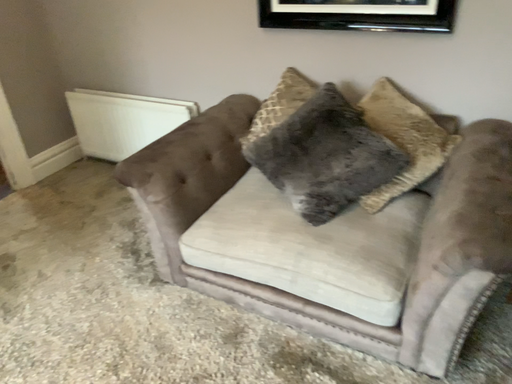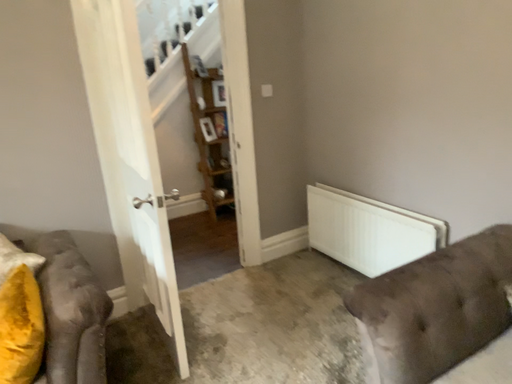
Question: How did the camera likely rotate when shooting the video?

Choices:
 (A) rotated upward
 (B) rotated downward

Answer: (A)